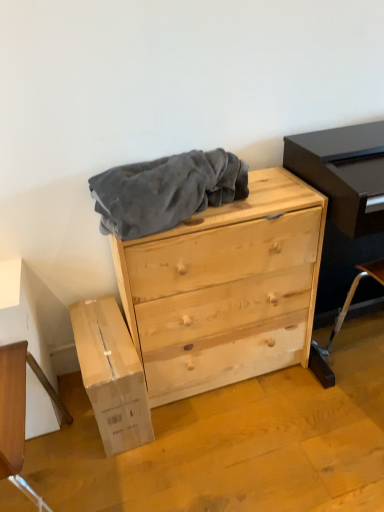
The width and height of the screenshot is (384, 512). In order to click on vacant space in front of natural wood chest of drawers at center in this screenshot , I will do `click(234, 452)`.